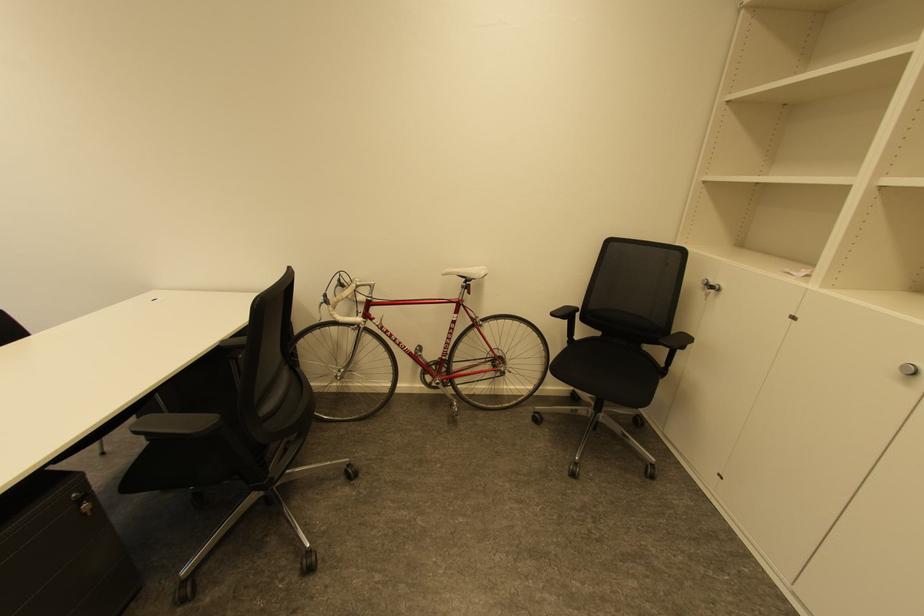
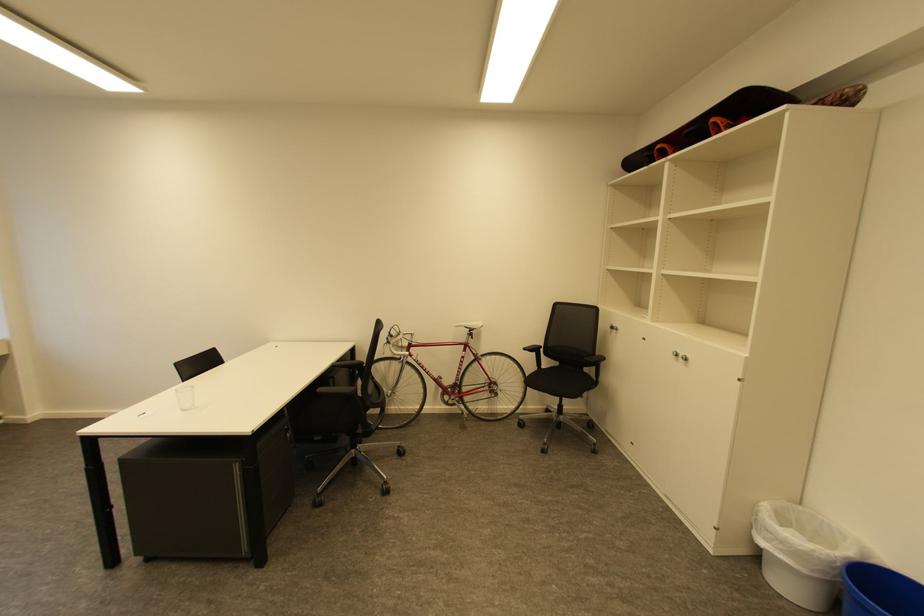
In the second image, find the point that corresponds to [464,313] in the first image.

(471, 351)